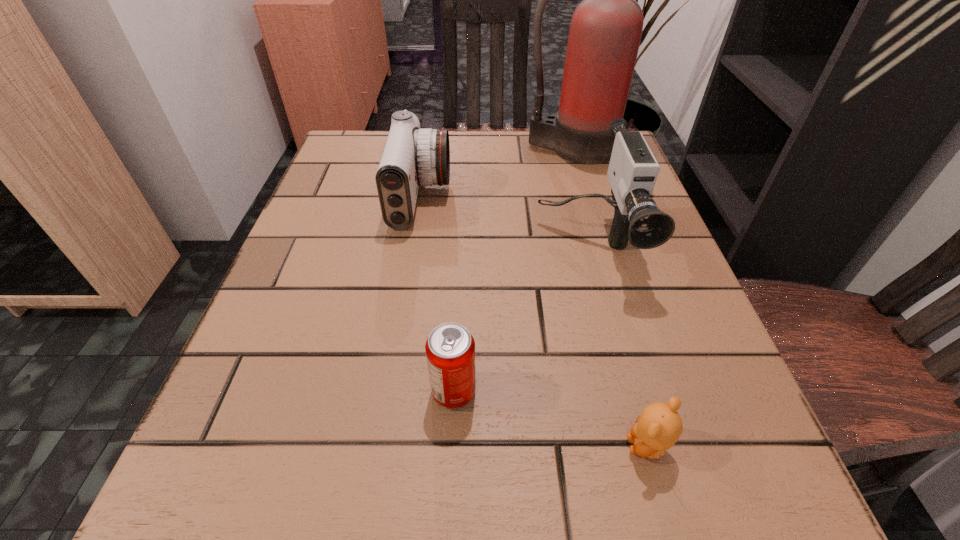
You are a GUI agent. You are given a task and a screenshot of the screen. Output one action in this format:
    pyautogui.click(x=<x>, y=<y>)
    Task: Click on the free space located at the nozzle of the tallest object
    This screenshot has width=960, height=540.
    Given the screenshot: What is the action you would take?
    pyautogui.click(x=587, y=203)

The height and width of the screenshot is (540, 960). What are the coordinates of `vacant space located 0.350m on the recording direction of the fourth shortest object` in the screenshot? It's located at (660, 525).

The image size is (960, 540). Identify the location of vacant space located on the surface of the third shortest object. (472, 198).

This screenshot has height=540, width=960. Find the location of `free space located 0.300m on the back of the second nearest object`. free space located 0.300m on the back of the second nearest object is located at coordinates (461, 235).

Find the location of `vacant space located 0.400m on the face of the teddy bear`. vacant space located 0.400m on the face of the teddy bear is located at coordinates (301, 446).

Where is `free space located 0.360m on the face of the teddy bear`? The width and height of the screenshot is (960, 540). free space located 0.360m on the face of the teddy bear is located at coordinates (334, 446).

Identify the location of free space located on the face of the teddy bear. Image resolution: width=960 pixels, height=540 pixels. (562, 446).

This screenshot has height=540, width=960. I want to click on fire extinguisher at the far edge, so pos(605,32).

Image resolution: width=960 pixels, height=540 pixels. I want to click on camcorder that is at the far edge, so click(x=412, y=156).

At what (x,y) coordinates should I click in order to perform the action: click on object present at the near edge. Please return your answer as a coordinate pair (x, y). Looking at the image, I should click on coord(657,429).